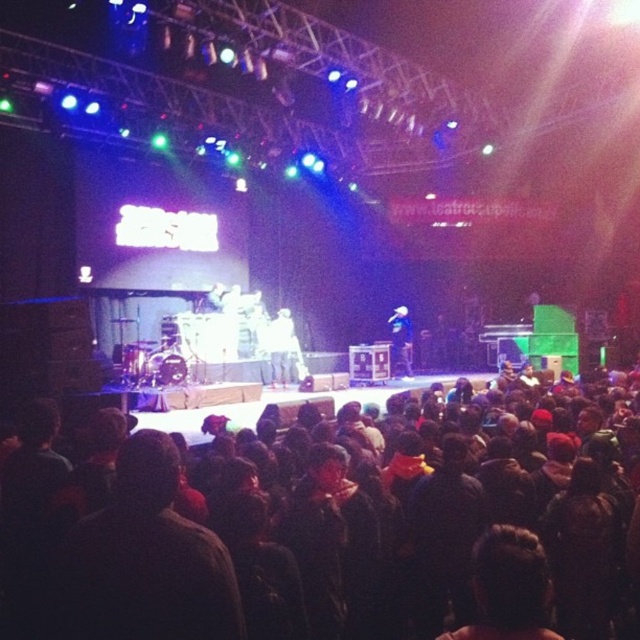
You are a photographer at the concert and want to capture both the dark fabric crowd at center and the shiny blue jacket at center in a single shot. Which object should you focus on first to ensure both are in frame?

You should focus on the dark fabric crowd at center first because it is larger in size compared to the shiny blue jacket at center, ensuring both fit within the frame.

You are a photographer at the concert trying to capture a closeup of the performer. You notice the dark brown hair at center and the dark fabric crowd at center. Which object should you move closer to in order to get a better shot?

The dark brown hair at center is behind dark fabric crowd at center, so to get a better shot, you should move closer to the dark fabric crowd at center to avoid obstruction.